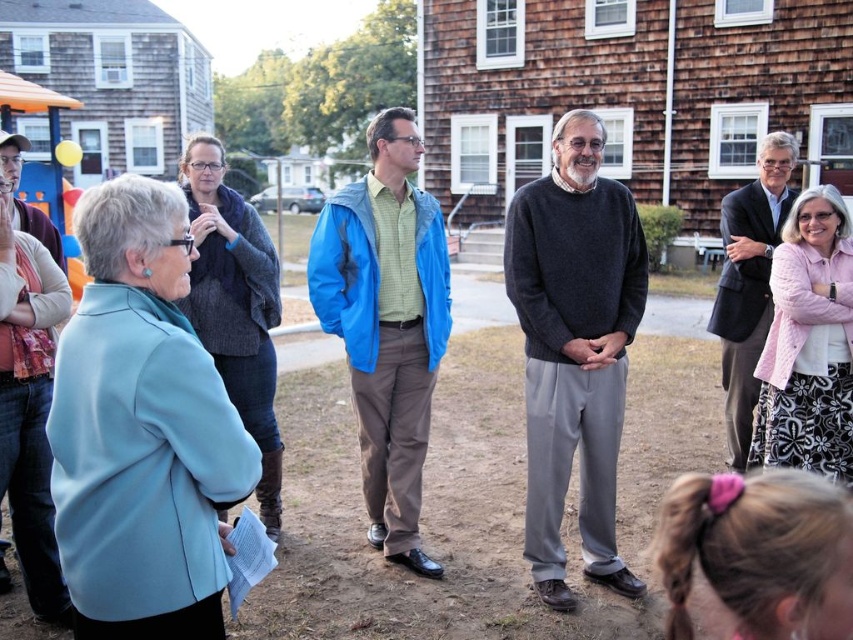
Question: Is blue fabric jacket at center further to the viewer compared to dark gray suit at right?

Choices:
 (A) yes
 (B) no

Answer: (B)

Question: Does dark gray sweater at center have a greater width compared to blue fabric jacket at center?

Choices:
 (A) yes
 (B) no

Answer: (B)

Question: Is dark gray sweater at center bigger than blue fabric jacket at center?

Choices:
 (A) no
 (B) yes

Answer: (B)

Question: Estimate the real-world distances between objects in this image. Which object is closer to the blue fabric jacket at center?

Choices:
 (A) dark gray suit at right
 (B) dark gray sweater at center

Answer: (B)

Question: Which is farther from the dark gray sweater at center?

Choices:
 (A) blue fabric jacket at center
 (B) dark gray suit at right

Answer: (B)

Question: Which object appears farthest from the camera in this image?

Choices:
 (A) blue fabric jacket at center
 (B) dark gray sweater at center
 (C) dark gray suit at right

Answer: (C)